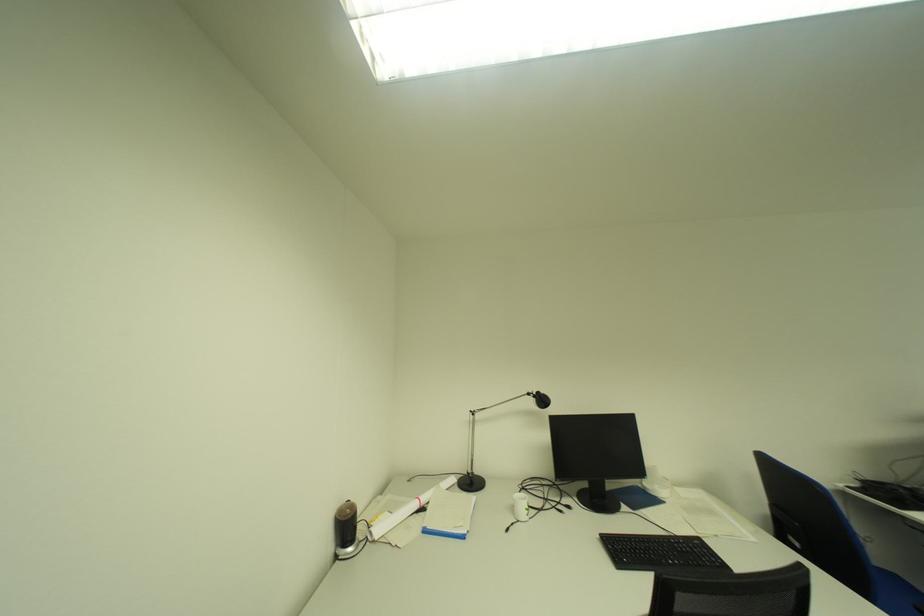
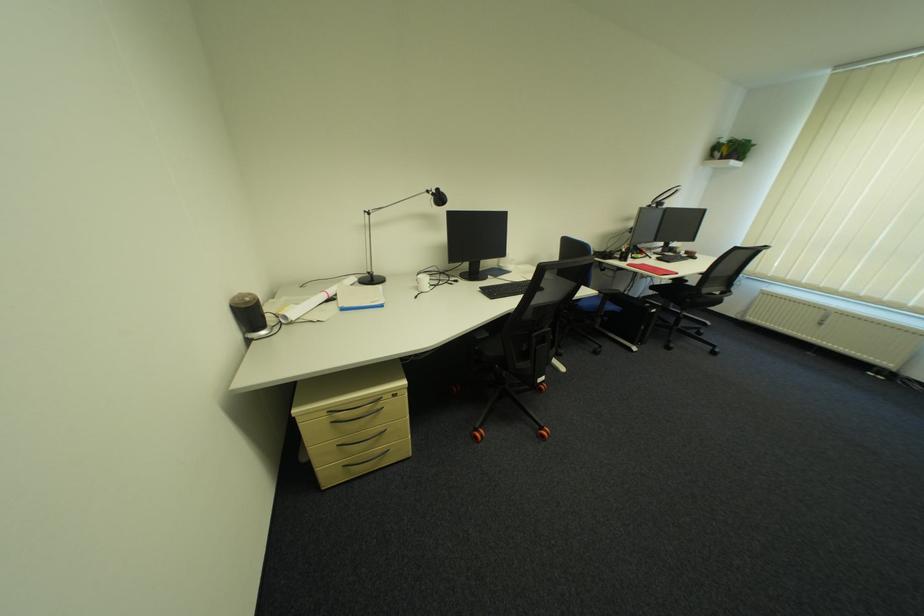
Where in the second image is the point corresponding to (x=426, y=506) from the first image?

(334, 298)